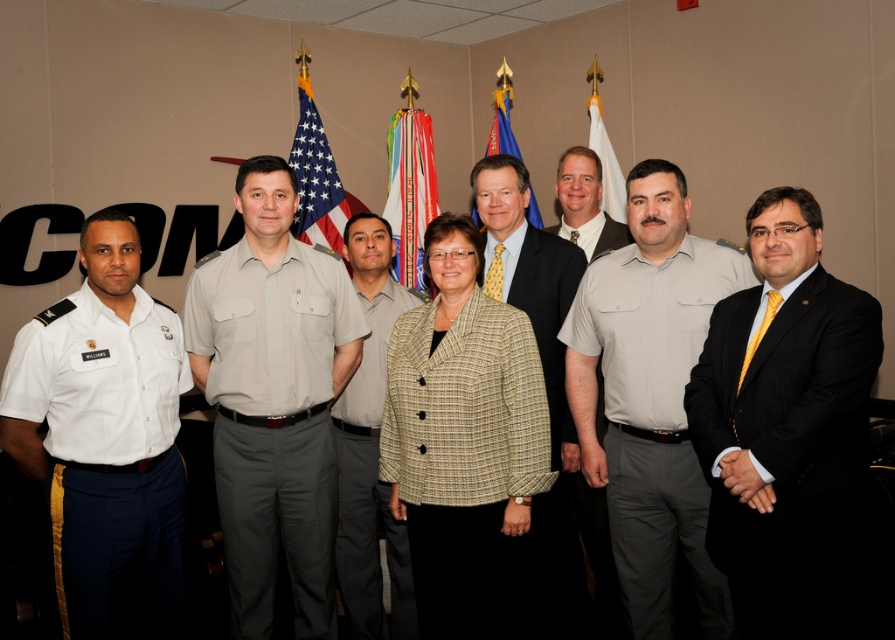
Question: Can you confirm if white fabric flag at center is positioned above khaki fabric uniform at center?

Choices:
 (A) yes
 (B) no

Answer: (A)

Question: Does light gray uniform at center appear over blue fabric flag at center?

Choices:
 (A) yes
 (B) no

Answer: (B)

Question: Which object appears farthest from the camera in this image?

Choices:
 (A) khaki fabric uniform at center
 (B) blue fabric flag at center
 (C) khaki uniform pants at center

Answer: (B)

Question: Based on their relative distances, which object is farther from the yellow tie at center?

Choices:
 (A) light gray uniform at center
 (B) white fabric flag at center
 (C) plaid wool blazer at center
 (D) white cotton shirt at left

Answer: (B)

Question: Is plaid wool blazer at center further to camera compared to american flag at center?

Choices:
 (A) yes
 (B) no

Answer: (B)

Question: Which point appears farthest from the camera in this image?

Choices:
 (A) (431, 182)
 (B) (541, 224)
 (C) (559, 612)

Answer: (B)